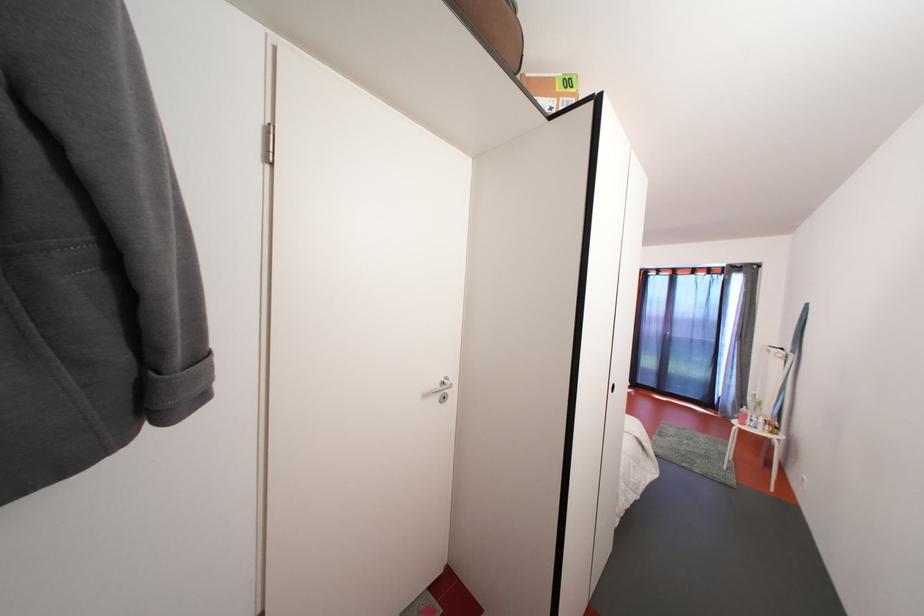
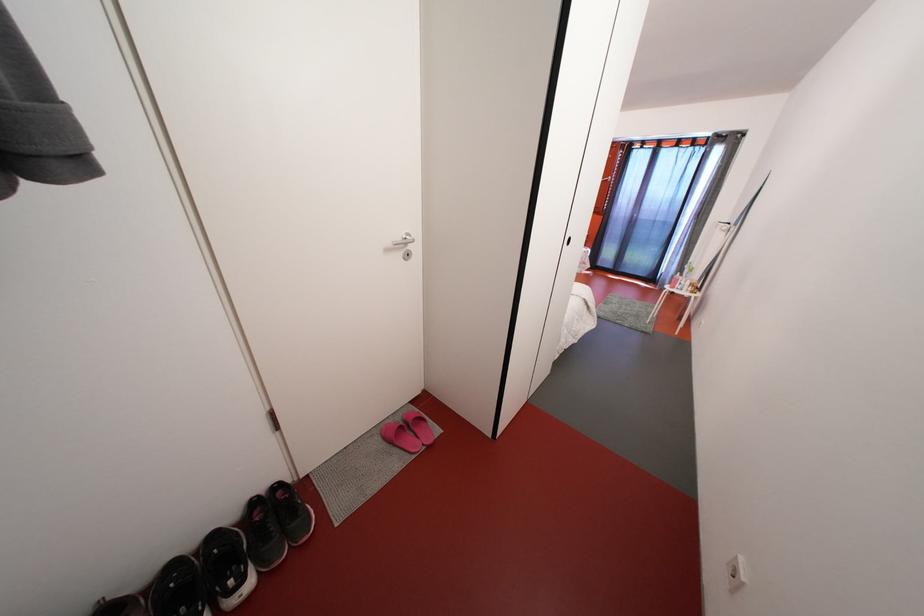
What movement of the cameraman would produce the second image?

The movement direction of the cameraman is right, backward.